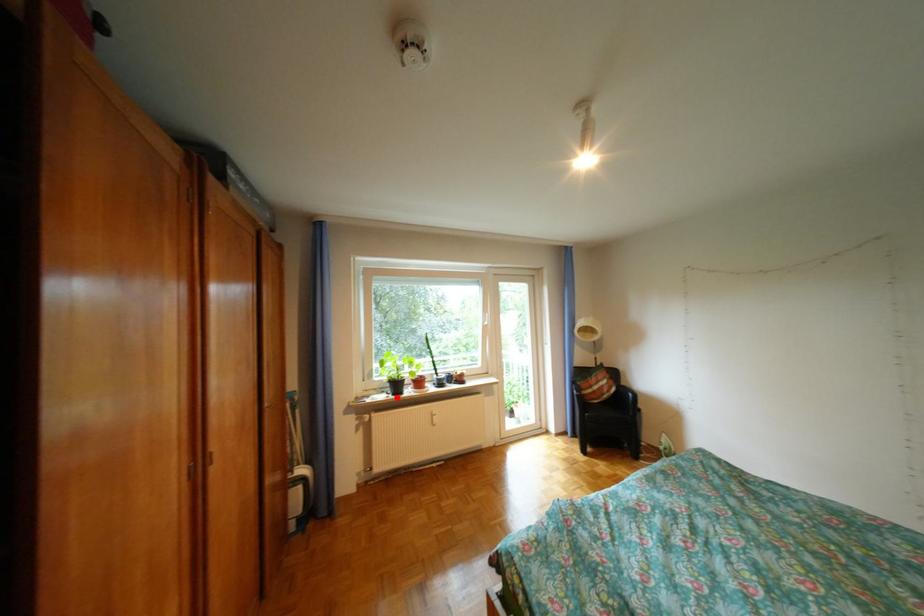
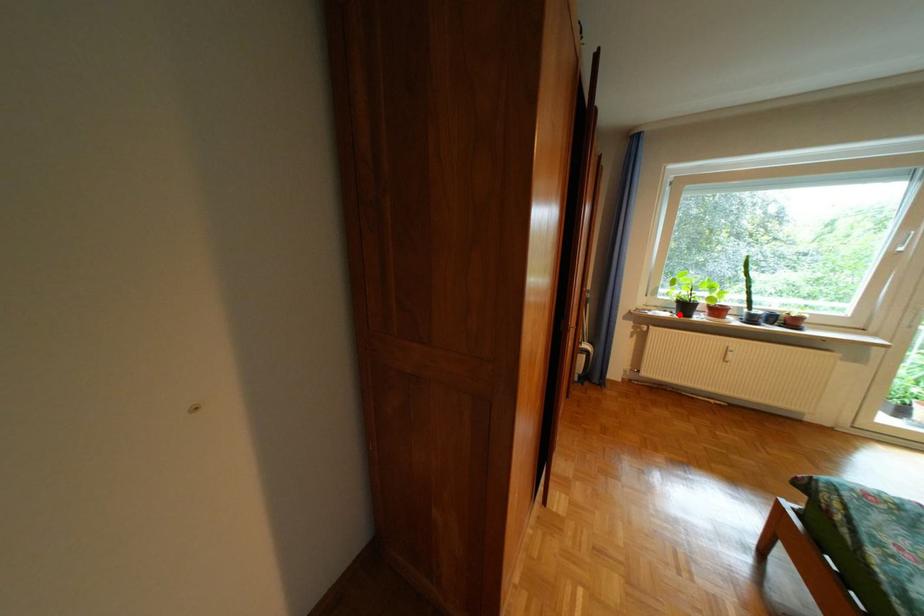
I am providing you with two images of the same scene from different viewpoints. A red point is marked on the first image and another point is marked on the second image. Is the red point in image1 aligned with the point shown in image2?

Yes